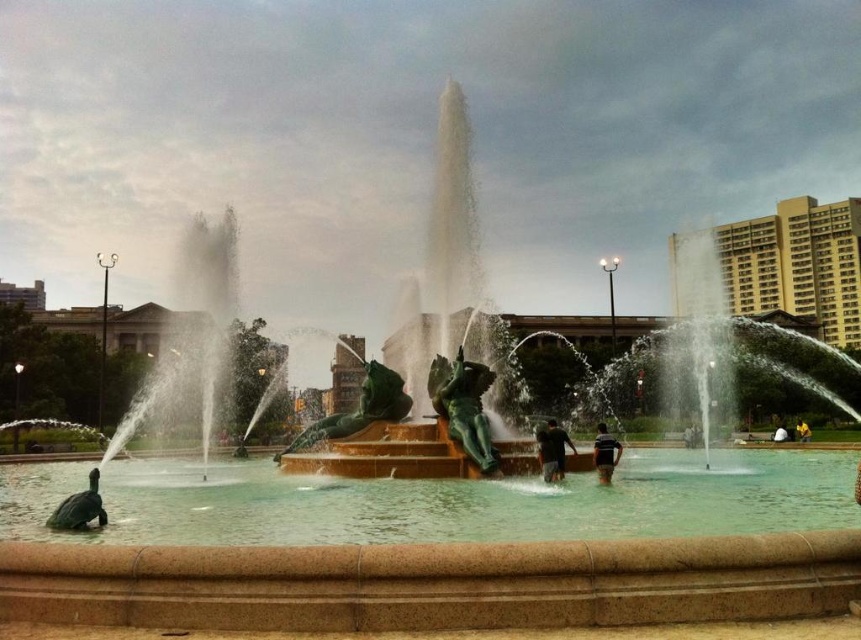
Question: Which object is positioned farthest from the green patina statue at center?

Choices:
 (A) dark brown leather shorts at center
 (B) green patina stone sculpture at center

Answer: (A)

Question: Which object is positioned farthest from the dark brown leather jacket at center?

Choices:
 (A) green patina statue at center
 (B) shiny bronze turtle at lower left
 (C) yellow fabric person at center

Answer: (C)

Question: Does green patina stone sculpture at center have a lesser width compared to yellow fabric person at center?

Choices:
 (A) yes
 (B) no

Answer: (A)

Question: Which of these objects is positioned farthest from the shiny bronze turtle at lower left?

Choices:
 (A) yellow fabric person at center
 (B) dark brown leather shorts at center
 (C) dark brown leather jacket at center

Answer: (A)

Question: Observing the image, what is the correct spatial positioning of green patina statue at center in reference to black matte shirt at center?

Choices:
 (A) left
 (B) right

Answer: (A)

Question: Is green patina statue at center behind dark brown leather jacket at center?

Choices:
 (A) no
 (B) yes

Answer: (B)